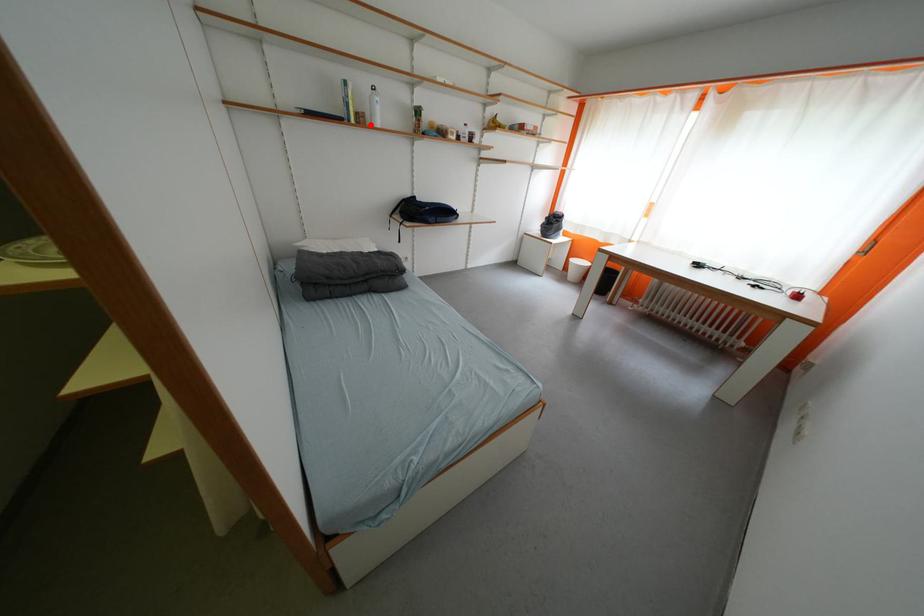
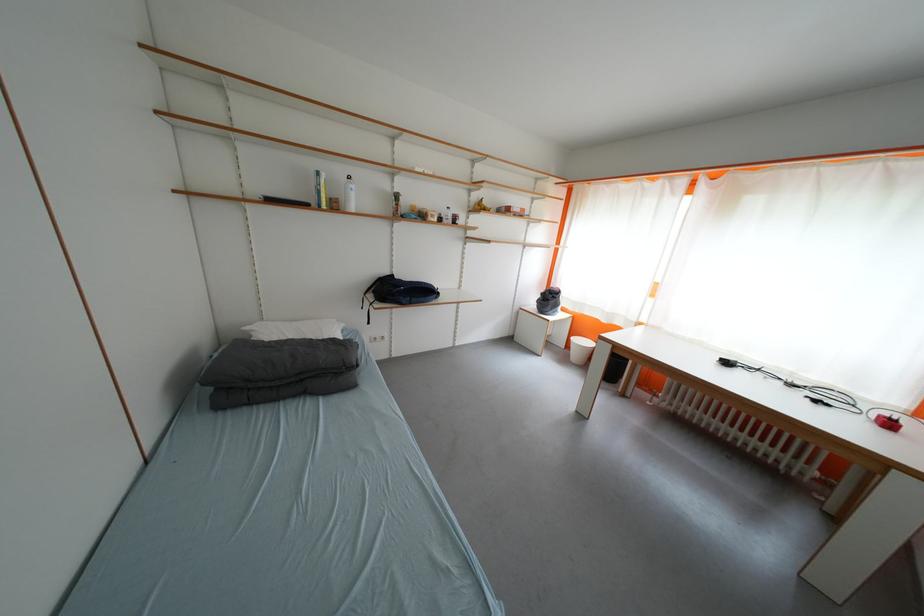
Locate, in the second image, the point that corresponds to the highlighted location in the first image.

(344, 209)